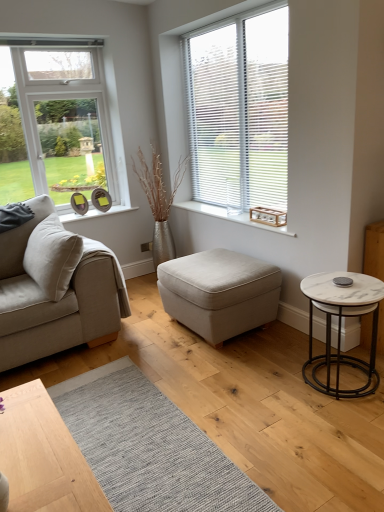
Question: From the image's perspective, is white blinds at upper right above or below light beige fabric ottoman at center?

Choices:
 (A) below
 (B) above

Answer: (B)

Question: Is point (218, 126) closer or farther from the camera than point (213, 328)?

Choices:
 (A) farther
 (B) closer

Answer: (A)

Question: Based on their relative distances, which object is nearer to the light beige fabric ottoman at center?

Choices:
 (A) white blinds at upper right
 (B) white marble side table at right
 (C) beige fabric couch at left
 (D) wooden crate at center

Answer: (D)

Question: Which of these objects is positioned farthest from the wooden crate at center?

Choices:
 (A) beige fabric couch at left
 (B) white blinds at upper right
 (C) white marble side table at right
 (D) light beige fabric ottoman at center

Answer: (A)